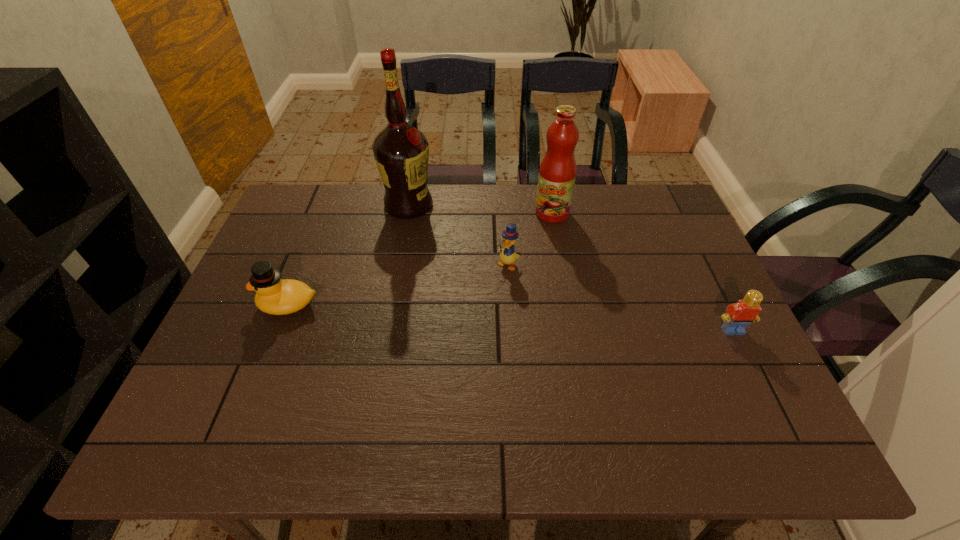
The image size is (960, 540). Identify the location of alcohol at the far edge. (401, 152).

Where is `fruit juice positioned at the far edge`? The height and width of the screenshot is (540, 960). fruit juice positioned at the far edge is located at coordinates click(x=557, y=173).

At what (x,y) coordinates should I click in order to perform the action: click on object that is at the left edge. Please return your answer as a coordinate pair (x, y). Looking at the image, I should click on (274, 296).

Where is `object present at the right edge`? This screenshot has height=540, width=960. object present at the right edge is located at coordinates (738, 316).

Locate an element on the screen. The image size is (960, 540). free space at the far edge of the desktop is located at coordinates (555, 224).

The image size is (960, 540). In the image, there is a desktop. What are the coordinates of `vacant space at the near edge` in the screenshot? It's located at (670, 391).

Find the location of a particular element. This screenshot has height=540, width=960. vacant space at the left edge of the desktop is located at coordinates (323, 238).

This screenshot has width=960, height=540. In order to click on free space at the right edge of the desktop in this screenshot , I will do `click(697, 273)`.

Find the location of a particular element. vacant area at the far right corner of the desktop is located at coordinates (635, 208).

The width and height of the screenshot is (960, 540). I want to click on free space that is in between the Lego and the duckling, so tap(620, 298).